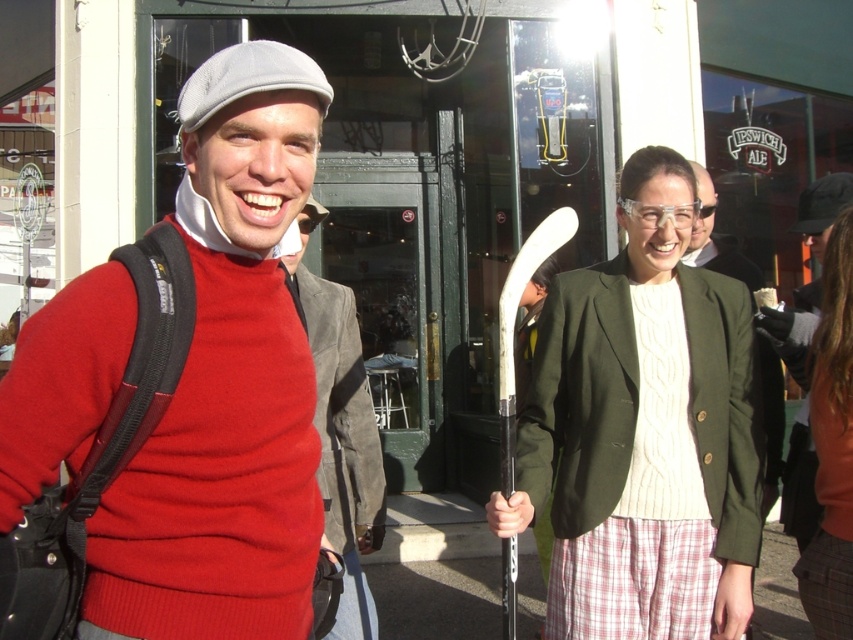
Which of these two, white cable-knit sweater at center or red sweater at left, stands taller?

With more height is red sweater at left.

Is white cable-knit sweater at center to the right of red sweater at left from the viewer's perspective?

Yes, white cable-knit sweater at center is to the right of red sweater at left.

Where is `white cable-knit sweater at center`? Image resolution: width=853 pixels, height=640 pixels. white cable-knit sweater at center is located at coordinates (579, 397).

You are a GUI agent. You are given a task and a screenshot of the screen. Output one action in this format:
    pyautogui.click(x=<x>, y=<y>)
    Task: Click on the white cable-knit sweater at center
    
    Given the screenshot: What is the action you would take?
    pyautogui.click(x=579, y=397)

Which is above, matte red sweater at center or red sweater at left?

Positioned higher is matte red sweater at center.

Between point (271, 129) and point (341, 444), which one is positioned in front?

Positioned in front is point (271, 129).

Measure the distance between matte red sweater at center and camera.

matte red sweater at center is 1.65 meters away from camera.

Locate an element on the screen. The image size is (853, 640). matte red sweater at center is located at coordinates (183, 388).

Is red sweater at left taller than green matte blazer at center?

Correct, red sweater at left is much taller as green matte blazer at center.

Identify the location of red sweater at left. The width and height of the screenshot is (853, 640). (341, 433).